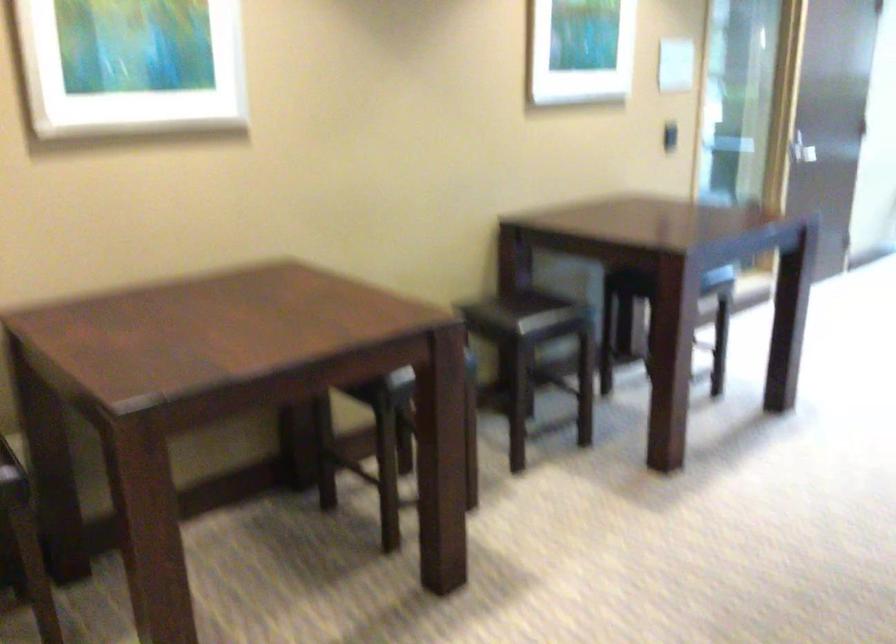
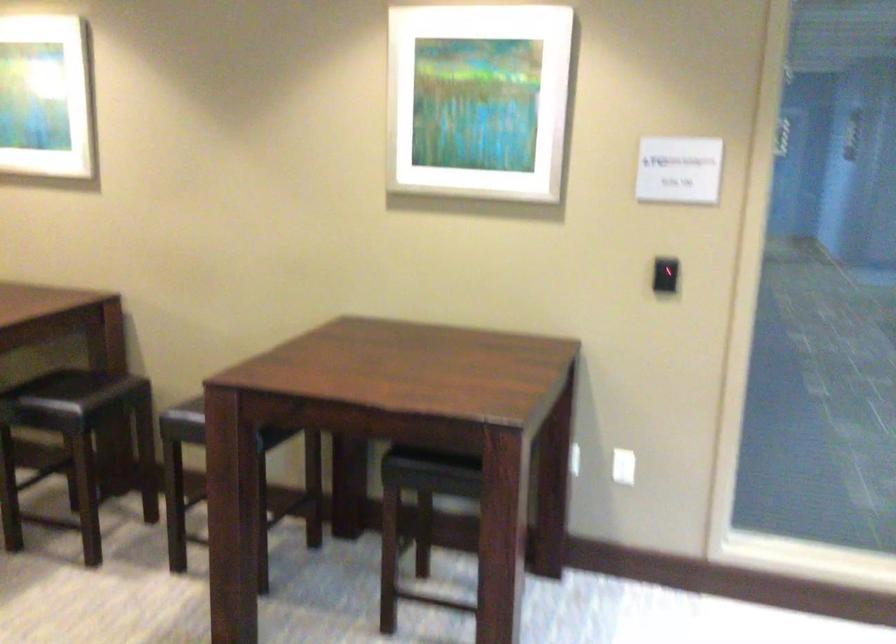
In the second image, find the point that corresponds to point 698,111 in the first image.

(665, 275)